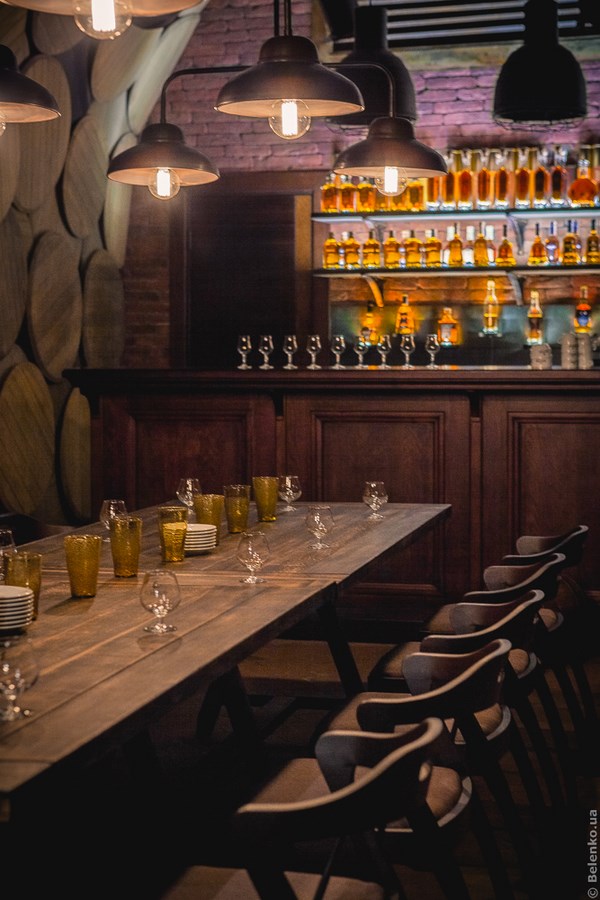
At what (x,y) coordinates should I click in order to perform the action: click on chairs. Please return your answer as a coordinate pair (x, y). The height and width of the screenshot is (900, 600). Looking at the image, I should click on (390, 778), (479, 694), (517, 618), (547, 565), (575, 540).